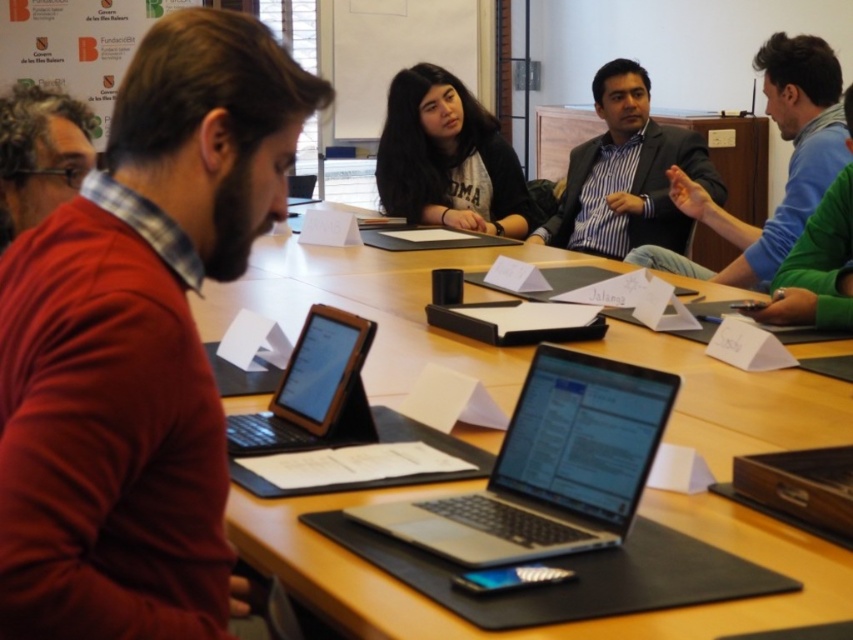
Question: Can you confirm if dark gray suit at center is wider than matte black shirt at center?

Choices:
 (A) yes
 (B) no

Answer: (A)

Question: Which of these objects is positioned closest to the black matte tablet at center?

Choices:
 (A) blue shirt at upper right
 (B) silver metallic laptop at center
 (C) matte black shirt at center
 (D) matte red sweater at left

Answer: (B)

Question: Which point appears closest to the camera in this image?

Choices:
 (A) (686, 372)
 (B) (807, 301)
 (C) (251, 451)
 (D) (338, 56)

Answer: (C)

Question: Which of these objects is positioned closest to the matte red sweater at left?

Choices:
 (A) silver metallic laptop at center
 (B) matte black shirt at center

Answer: (A)

Question: Does dark gray suit at center have a lesser width compared to matte black shirt at center?

Choices:
 (A) yes
 (B) no

Answer: (B)

Question: Does wooden table at center have a smaller size compared to silver metallic laptop at center?

Choices:
 (A) no
 (B) yes

Answer: (A)